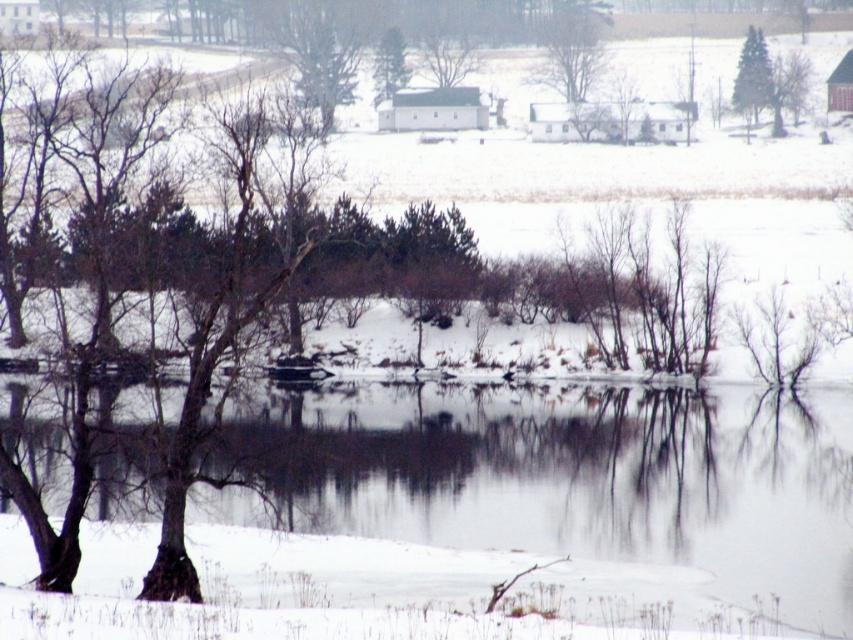
You are planning to place a small wooden bench in the winter landscape scene. The bench needs to be positioned between the clear water at lower center and the green matte tree at upper center. Given their widths, which object should the bench be closer to?

The clear water at lower center is wider than the green matte tree at upper center. Therefore, the bench should be placed closer to the green matte tree at upper center to maintain balance between the two objects.

You are an artist planning to paint the winter landscape. You want to ensure the smooth bark tree at upper right and the green matte tree at upper center are proportionally accurate. Which tree should you depict as wider in your painting?

The smooth bark tree at upper right should be depicted as wider in the painting since it might be wider than the green matte tree at upper center according to the description.

You are standing at the edge of the snow field and want to cross to the other side. There is a clear water at lower center located at point (x=570, y=477). Can you safely walk across the clear water at lower center?

The clear water at lower center is located at point (x=570, y=477). Since it is clear water, it might not be frozen solid, so it may not be safe to walk across.